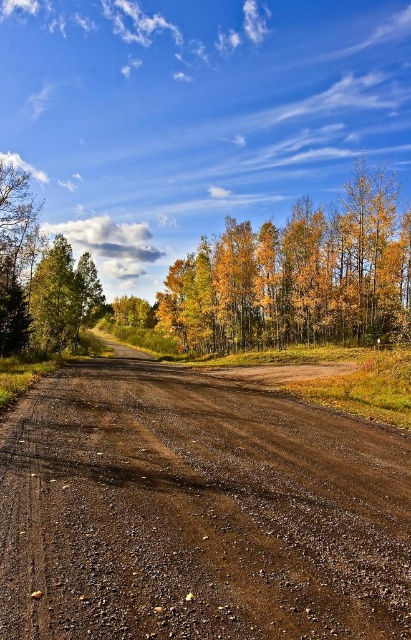
You are standing at the top of a hill overlooking the brown gravel road at center and the golden leaves forest at center. Which object is positioned lower in the scene?

The brown gravel road at center is positioned lower than the golden leaves forest at center.

You are a hiker planning to cross the brown gravel road at center and the golden leaves forest at center. Which path has a narrower width?

The brown gravel road at center has a lesser width compared to the golden leaves forest at center, so the brown gravel road at center is narrower.